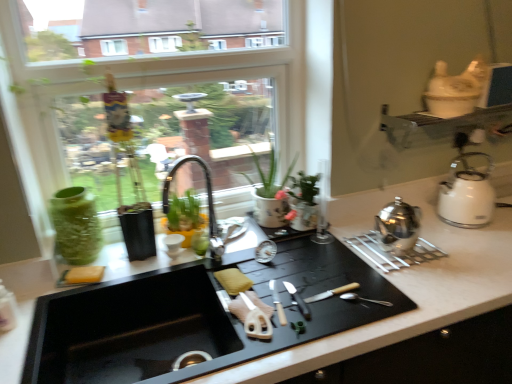
The image size is (512, 384). In order to click on free spot above black matte countertop at center (from a real-world perspective) in this screenshot , I will do `click(331, 271)`.